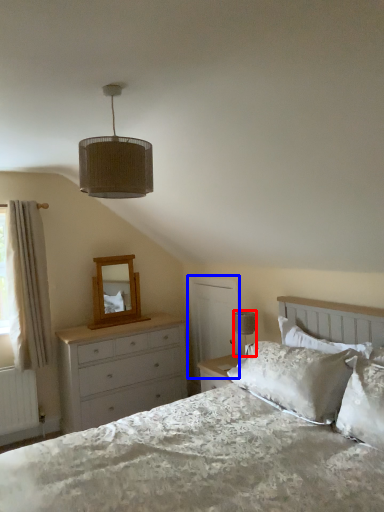
Question: Which object appears closest to the camera in this image, table lamp (highlighted by a red box) or screen door (highlighted by a blue box)?

Choices:
 (A) table lamp
 (B) screen door

Answer: (A)